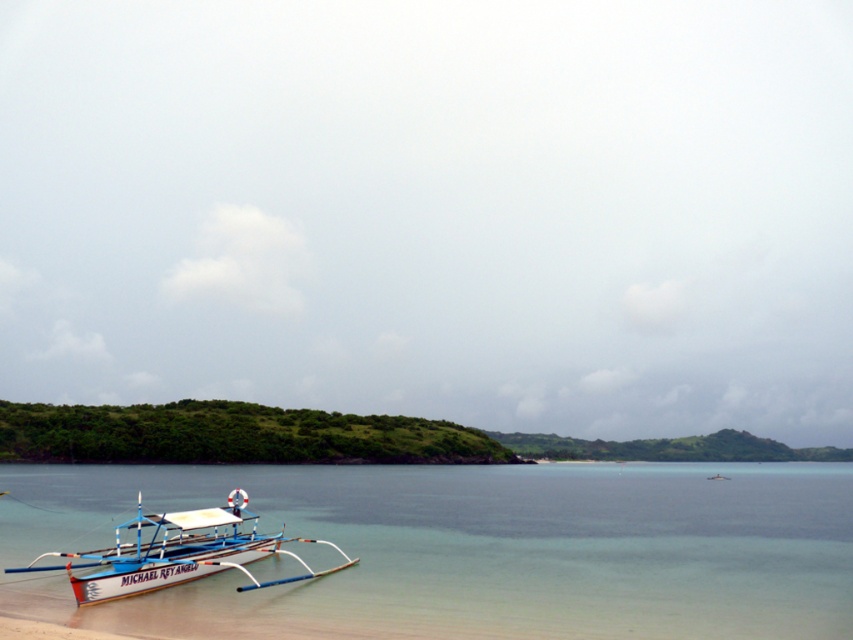
Does point (494, 573) lie behind point (202, 524)?

Yes, point (494, 573) is behind point (202, 524).

Does clear blue water at lower left have a lesser width compared to white matte boat at lower left?

No, clear blue water at lower left is not thinner than white matte boat at lower left.

Locate an element on the screen. The image size is (853, 640). clear blue water at lower left is located at coordinates (471, 548).